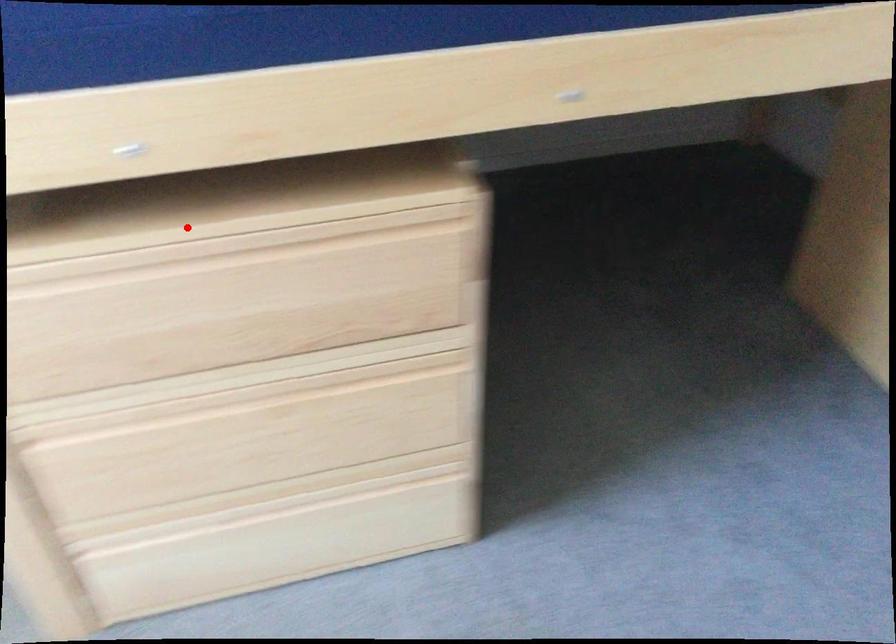
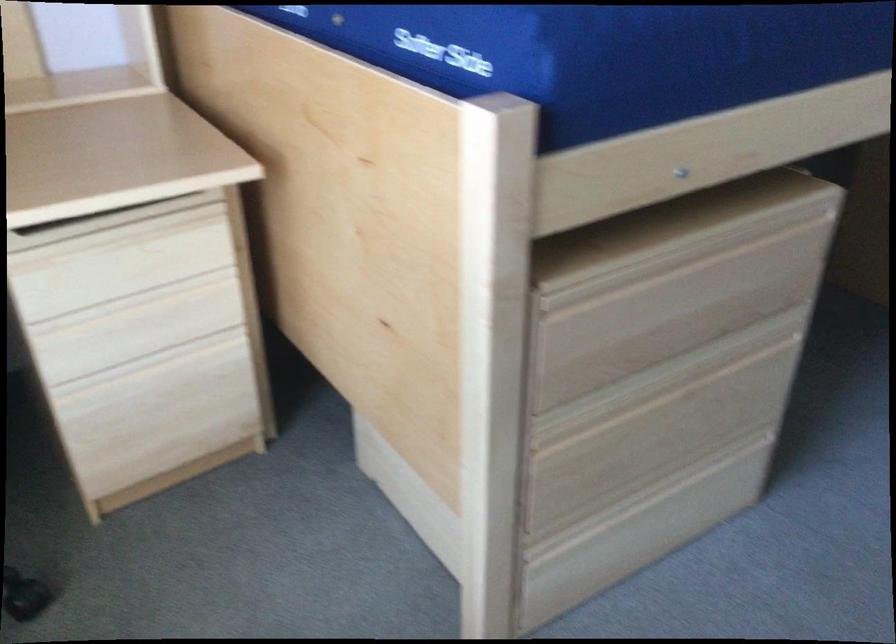
Question: I am providing you with two images of the same scene from different viewpoints. Given a red point in image1, look at the same physical point in image2. Is it:

Choices:
 (A) Closer to the viewpoint
 (B) Farther from the viewpoint

Answer: (B)